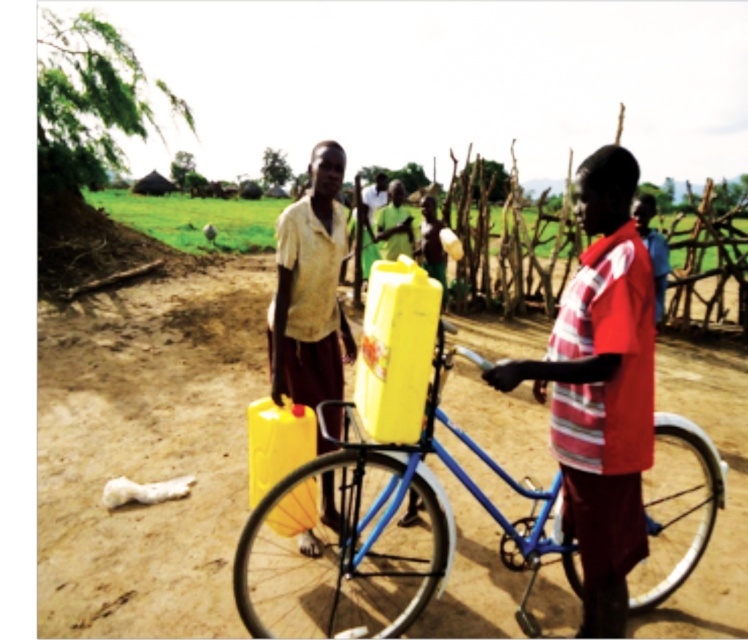
Question: Which is nearer to the blue metallic bicycle at center?

Choices:
 (A) matte yellow plastic jerrycan at center
 (B) matte red shirt at center

Answer: (B)

Question: Estimate the real-world distances between objects in this image. Which object is closer to the matte yellow plastic jerrycan at center?

Choices:
 (A) blue metallic bicycle at center
 (B) matte red shirt at center

Answer: (A)

Question: Is matte red shirt at center below matte yellow plastic jerrycan at center?

Choices:
 (A) no
 (B) yes

Answer: (B)

Question: Is blue metallic bicycle at center positioned before matte yellow plastic jerrycan at center?

Choices:
 (A) no
 (B) yes

Answer: (B)

Question: Can you confirm if blue metallic bicycle at center is bigger than matte yellow plastic jerrycan at center?

Choices:
 (A) no
 (B) yes

Answer: (B)

Question: Which point appears farthest from the camera in this image?

Choices:
 (A) (289, 317)
 (B) (646, 474)
 (C) (637, 291)

Answer: (B)